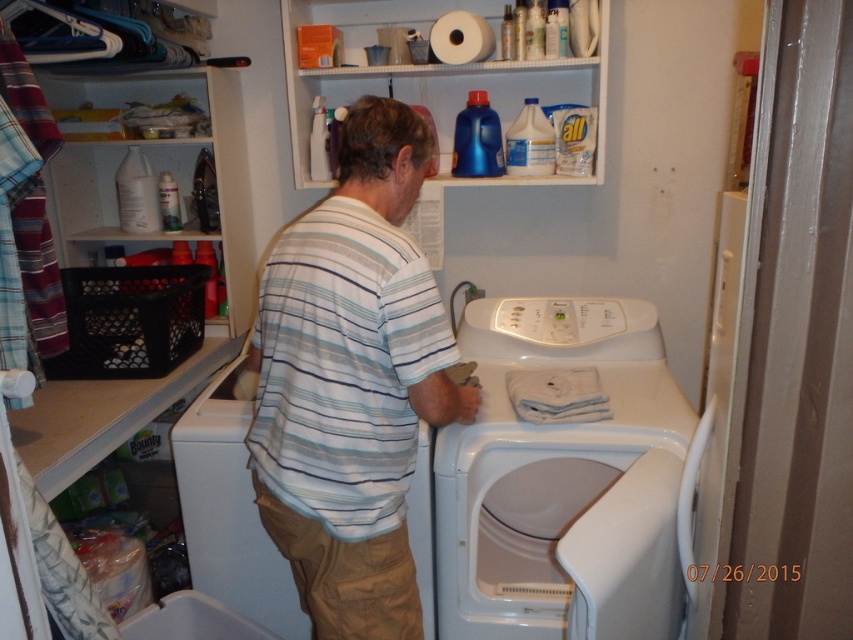
Question: Among these objects, which one is farthest from the camera?

Choices:
 (A) white matte toilet paper at upper center
 (B) white striped shirt at center
 (C) white matte washing machine at center

Answer: (A)

Question: Which of the following is the closest to the observer?

Choices:
 (A) (254, 317)
 (B) (13, 10)
 (C) (427, 452)

Answer: (B)

Question: Can you confirm if white plastic shelf at upper center is positioned below black plastic basket at left?

Choices:
 (A) yes
 (B) no

Answer: (B)

Question: Is white plastic shelf at upper center to the left of white matte washing machine at center from the viewer's perspective?

Choices:
 (A) yes
 (B) no

Answer: (B)

Question: Considering the relative positions of black plastic basket at left and white matte toilet paper at upper center in the image provided, where is black plastic basket at left located with respect to white matte toilet paper at upper center?

Choices:
 (A) right
 (B) left

Answer: (B)

Question: Which of the following is the farthest from the observer?

Choices:
 (A) white glossy washing machine at center
 (B) white striped shirt at center
 (C) black plastic basket at left
 (D) white matte washing machine at center

Answer: (C)